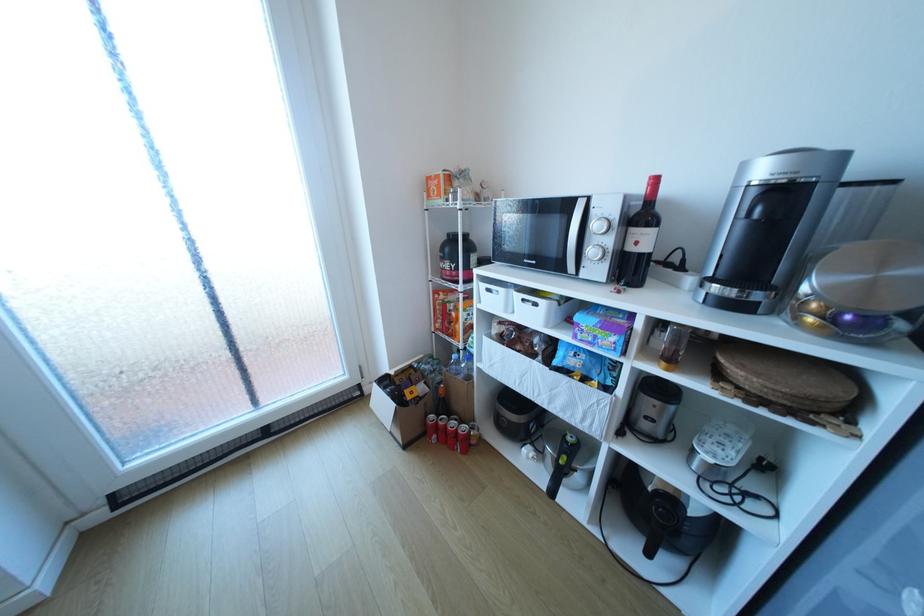
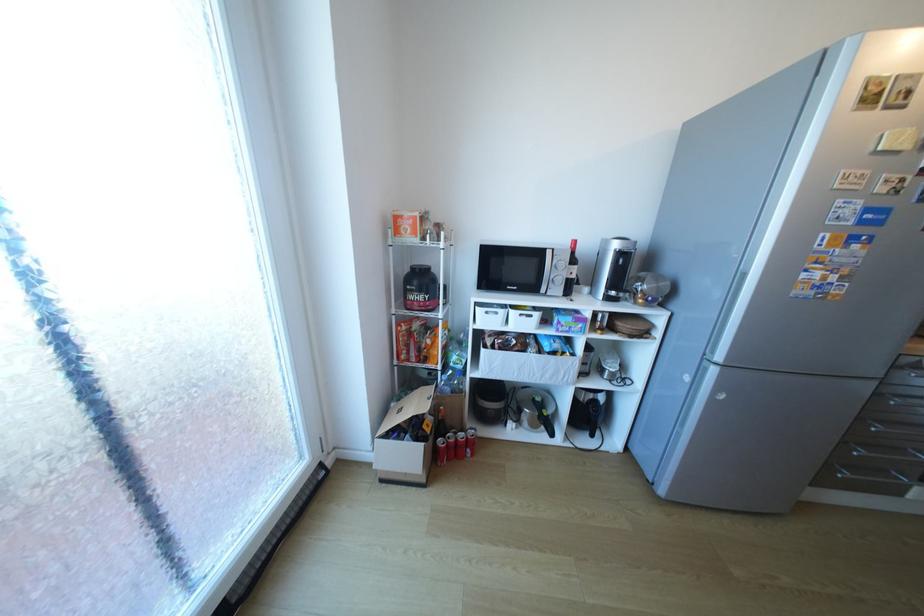
Locate, in the second image, the point that corresponds to (x=497, y=290) in the first image.

(495, 313)